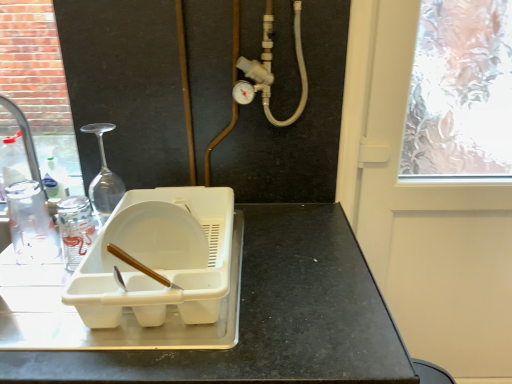
Question: In terms of width, does white plastic dish rack at center look wider or thinner when compared to transparent frosted glass screen door at upper right?

Choices:
 (A) wide
 (B) thin

Answer: (A)

Question: Is white plastic dish rack at center taller or shorter than transparent frosted glass screen door at upper right?

Choices:
 (A) short
 (B) tall

Answer: (A)

Question: Based on their relative distances, which object is nearer to the white plastic tray at center?

Choices:
 (A) brushed metal faucet at left
 (B) transparent frosted glass screen door at upper right
 (C) clear plastic bottle at left
 (D) white plastic dish rack at center

Answer: (D)

Question: Which object is positioned closest to the white plastic dish rack at center?

Choices:
 (A) clear plastic bottle at left
 (B) white plastic tray at center
 (C) transparent frosted glass screen door at upper right
 (D) brushed metal faucet at left

Answer: (B)